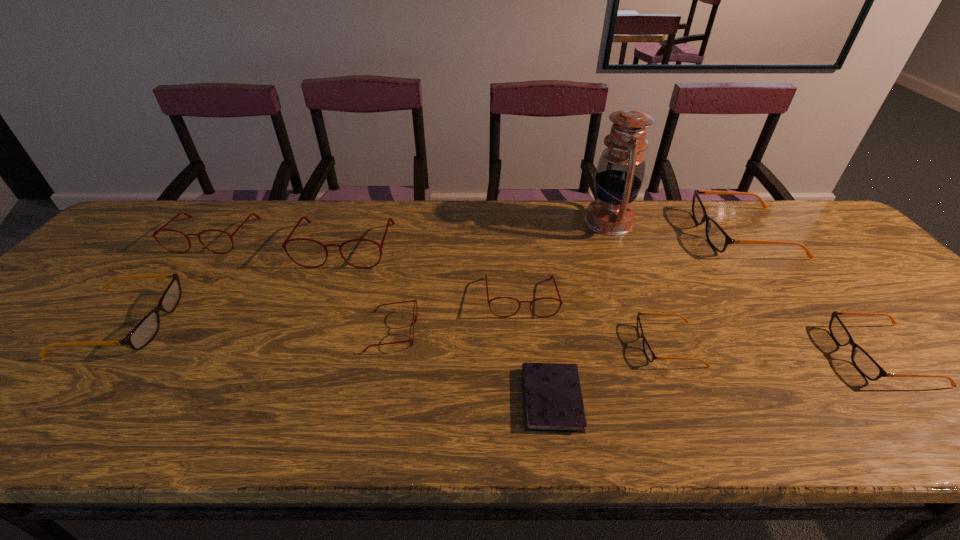
Identify the location of the third biggest black spectacles. This screenshot has height=540, width=960. click(866, 365).

At what (x,y) coordinates should I click in order to perform the action: click on the smallest black spectacles. Please return your answer as a coordinate pair (x, y). This screenshot has height=540, width=960. Looking at the image, I should click on (651, 357).

At what (x,y) coordinates should I click in order to perform the action: click on the shortest spectacles. Please return your answer as a coordinate pair (x, y). Looking at the image, I should click on (651, 357).

Image resolution: width=960 pixels, height=540 pixels. I want to click on the shortest object, so click(553, 402).

Locate an element on the screen. This screenshot has height=540, width=960. free spot located 0.300m on the front of the tallest object is located at coordinates (646, 316).

Locate an element on the screen. The width and height of the screenshot is (960, 540). vacant space located on the face of the ninth shortest object is located at coordinates (325, 297).

Locate an element on the screen. This screenshot has width=960, height=540. vacant space located 0.120m on the face of the third smallest red spectacles is located at coordinates (178, 282).

I want to click on vacant point located on the front-facing side of the farthest black spectacles, so pyautogui.click(x=591, y=233).

Locate an element on the screen. The width and height of the screenshot is (960, 540). free region located on the front-facing side of the farthest black spectacles is located at coordinates (655, 233).

At what (x,y) coordinates should I click in order to perform the action: click on vacant position located on the front-facing side of the farthest black spectacles. Please return your answer as a coordinate pair (x, y). Looking at the image, I should click on (652, 233).